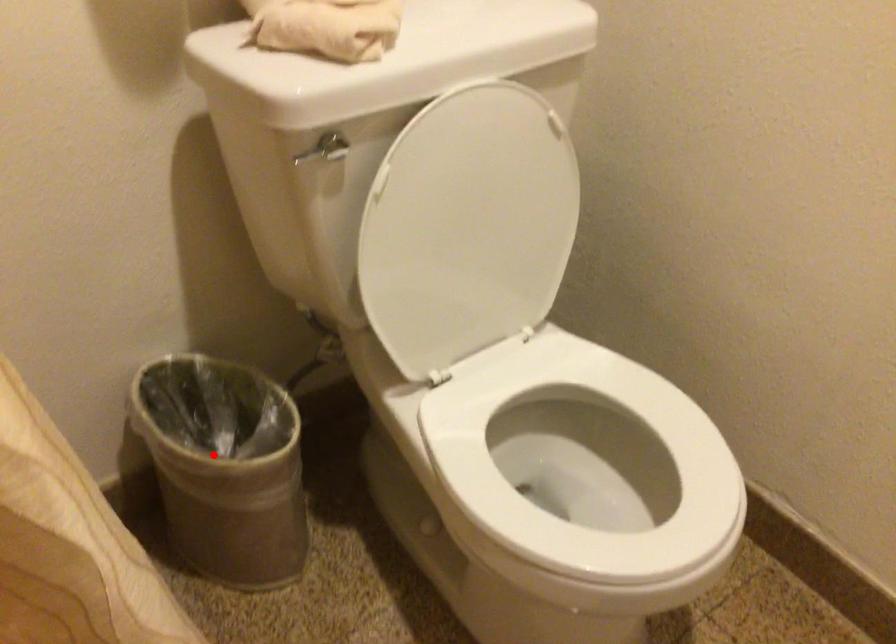
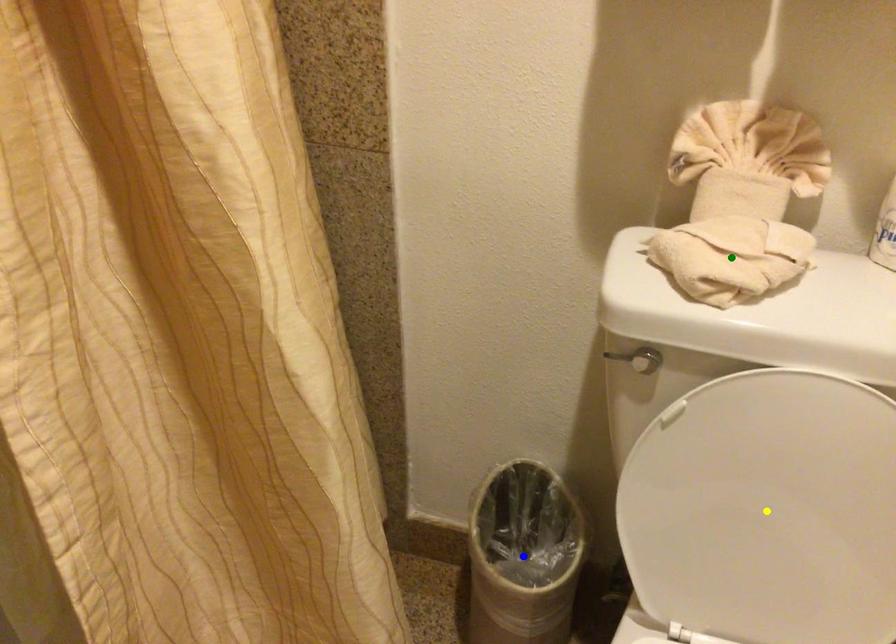
Question: I am providing you with two images of the same scene from different viewpoints. A red point is marked on the first image. You are given multiple points on the second image. Can you choose the point in image 2 that corresponds to the point in image 1?

Choices:
 (A) blue point
 (B) green point
 (C) yellow point

Answer: (A)